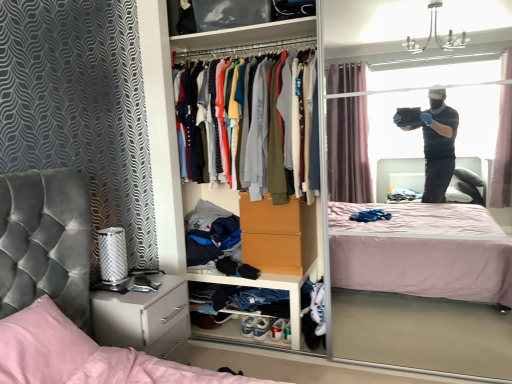
What is the approximate width of pink quilted bed at center?

The width of pink quilted bed at center is 5.92 feet.

The height and width of the screenshot is (384, 512). What do you see at coordinates (262, 328) in the screenshot? I see `white leather sneakers at lower center, placed as the second footwear when sorted from left to right` at bounding box center [262, 328].

Describe the element at coordinates (272, 125) in the screenshot. I see `soft cotton shirts at center` at that location.

Identify the location of pink quilted bed at center. (62, 292).

Does soft cotton shirts at center lie in front of pink satin pillow at lower left?

No.

Would you consider soft cotton shirts at center to be distant from pink satin pillow at lower left?

That's right, there is a large distance between soft cotton shirts at center and pink satin pillow at lower left.

Does soft cotton shirts at center have a greater height compared to pink satin pillow at lower left?

Indeed, soft cotton shirts at center has a greater height compared to pink satin pillow at lower left.

Is white leather sneakers at lower center, positioned as the 2th footwear in right-to-left order, next to pink quilted bed at center?

No, white leather sneakers at lower center, positioned as the 2th footwear in right-to-left order, is not touching pink quilted bed at center.

Do you think white leather sneakers at lower center, positioned as the 2th footwear in right-to-left order, is within pink quilted bed at center, or outside of it?

white leather sneakers at lower center, positioned as the 2th footwear in right-to-left order, cannot be found inside pink quilted bed at center.

Which is less distant, (249,319) or (47,323)?

The point (47,323) is closer to the camera.

Does pink quilted bed at center have a lesser width compared to white glossy nightstand at lower left?

Incorrect, the width of pink quilted bed at center is not less than that of white glossy nightstand at lower left.

Is pink quilted bed at center closer to camera compared to white glossy nightstand at lower left?

Yes.

Is point (2, 207) positioned in front of point (148, 308)?

Yes.

From the image's perspective, relative to white glossy nightstand at lower left, is pink quilted bed at center above or below?

From the image's perspective, pink quilted bed at center appears above white glossy nightstand at lower left.

Is white leather sneakers at lower center, marked as the first footwear in a right-to-left arrangement, spatially inside white glossy nightstand at lower left, or outside of it?

white leather sneakers at lower center, marked as the first footwear in a right-to-left arrangement, is not enclosed by white glossy nightstand at lower left.

Is white leather sneakers at lower center, placed as the second footwear when sorted from left to right, thinner than white glossy nightstand at lower left?

Yes.

From the image's perspective, is white leather sneakers at lower center, placed as the second footwear when sorted from left to right, located beneath white glossy nightstand at lower left?

Yes.

Considering the positions of objects white leather sneakers at lower center, placed as the second footwear when sorted from left to right, and white glossy nightstand at lower left in the image provided, who is more to the right, white leather sneakers at lower center, placed as the second footwear when sorted from left to right, or white glossy nightstand at lower left?

white leather sneakers at lower center, placed as the second footwear when sorted from left to right, is more to the right.

Which of these two, pink quilted bed at center or white matte cabinet at lower center, stands shorter?

With less height is white matte cabinet at lower center.

Looking at the image, does pink quilted bed at center seem bigger or smaller compared to white matte cabinet at lower center?

pink quilted bed at center is bigger than white matte cabinet at lower center.

From the image's perspective, is pink quilted bed at center located beneath white matte cabinet at lower center?

No, from the image's perspective, pink quilted bed at center is not beneath white matte cabinet at lower center.

Find the location of `cabinet below the pink quilted bed at center (from the image's perspective)`. cabinet below the pink quilted bed at center (from the image's perspective) is located at coordinates (270, 288).

Consider the image. From a real-world perspective, is white matte cabinet at lower center below pink satin pillow at lower left?

Indeed, from a real-world perspective, white matte cabinet at lower center is positioned beneath pink satin pillow at lower left.

Is point (231, 280) positioned behind point (66, 340)?

Yes, it is.

At what (x,y) coordinates should I click in order to perform the action: click on cabinet to the right of pink satin pillow at lower left. Please return your answer as a coordinate pair (x, y). The height and width of the screenshot is (384, 512). Looking at the image, I should click on (270, 288).

Considering their positions, is white matte cabinet at lower center located in front of or behind pink satin pillow at lower left?

Clearly, white matte cabinet at lower center is behind pink satin pillow at lower left.

Is pink satin pillow at lower left closer to the viewer compared to soft cotton shirts at center?

Yes, the depth of pink satin pillow at lower left is less than that of soft cotton shirts at center.

Considering the sizes of objects pink satin pillow at lower left and soft cotton shirts at center in the image provided, who is bigger, pink satin pillow at lower left or soft cotton shirts at center?

soft cotton shirts at center.

Which of these two, pink satin pillow at lower left or soft cotton shirts at center, is wider?

Wider between the two is soft cotton shirts at center.

Would you say pink satin pillow at lower left is to the left or to the right of soft cotton shirts at center in the picture?

Based on their positions, pink satin pillow at lower left is located to the left of soft cotton shirts at center.

The height and width of the screenshot is (384, 512). I want to click on pillow directly beneath the soft cotton shirts at center (from a real-world perspective), so click(x=42, y=345).

From the pink quilted bed at center, count 2nd footwears backward and point to it. Please provide its 2D coordinates.

[(248, 326)]

Based on their spatial positions, is white leather sneakers at lower center, arranged as the 1th footwear when viewed from the left, or white leather sneakers at lower center, marked as the first footwear in a right-to-left arrangement, further from soft cotton shirts at center?

Based on the image, white leather sneakers at lower center, arranged as the 1th footwear when viewed from the left, appears to be further to soft cotton shirts at center.

Based on their spatial positions, is white leather sneakers at lower center, marked as the first footwear in a right-to-left arrangement, or white glossy nightstand at lower left further from white matte cabinet at lower center?

Among the two, white glossy nightstand at lower left is located further to white matte cabinet at lower center.

Considering their positions, is white leather sneakers at lower center, marked as the first footwear in a right-to-left arrangement, positioned further to soft cotton shirts at center than white leather sneakers at lower center, positioned as the 2th footwear in right-to-left order?

The object further to soft cotton shirts at center is white leather sneakers at lower center, positioned as the 2th footwear in right-to-left order.

Looking at the image, which one is located closer to pink satin pillow at lower left, white matte cabinet at lower center or pink quilted bed at center?

pink quilted bed at center is positioned closer to the anchor pink satin pillow at lower left.

Considering their positions, is white glossy nightstand at lower left positioned further to pink satin pillow at lower left than white leather sneakers at lower center, arranged as the 1th footwear when viewed from the left?

Among the two, white leather sneakers at lower center, arranged as the 1th footwear when viewed from the left, is located further to pink satin pillow at lower left.

From the image, which object appears to be nearer to pink satin pillow at lower left, white glossy nightstand at lower left or white leather sneakers at lower center, placed as the second footwear when sorted from left to right?

white glossy nightstand at lower left is closer to pink satin pillow at lower left.

Looking at the image, which one is located further to white matte cabinet at lower center, white glossy nightstand at lower left or pink satin pillow at lower left?

pink satin pillow at lower left lies further to white matte cabinet at lower center than the other object.

Estimate the real-world distances between objects in this image. Which object is further from pink satin pillow at lower left, pink quilted bed at center or white matte cabinet at lower center?

white matte cabinet at lower center lies further to pink satin pillow at lower left than the other object.

You are a GUI agent. You are given a task and a screenshot of the screen. Output one action in this format:
    pyautogui.click(x=<x>, y=<y>)
    Task: Click on the footwear between soft cotton shirts at center and white leather sneakers at lower center, arranged as the 1th footwear when viewed from the left, in the up-down direction
    The width and height of the screenshot is (512, 384).
    Given the screenshot: What is the action you would take?
    pyautogui.click(x=262, y=328)

Find the location of a particular element. The height and width of the screenshot is (384, 512). cabinetry positioned between pink quilted bed at center and white leather sneakers at lower center, placed as the second footwear when sorted from left to right, from near to far is located at coordinates (145, 319).

Identify the location of pillow positioned between pink quilted bed at center and white matte cabinet at lower center from near to far. (42, 345).

This screenshot has width=512, height=384. What are the coordinates of `cabinet between soft cotton shirts at center and white leather sneakers at lower center, marked as the first footwear in a right-to-left arrangement, from top to bottom` in the screenshot? It's located at (270, 288).